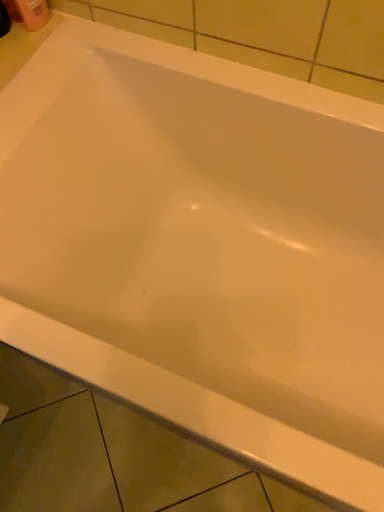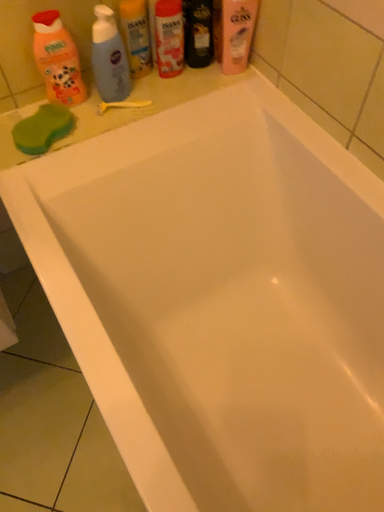
Question: How did the camera likely rotate when shooting the video?

Choices:
 (A) rotated right
 (B) rotated left

Answer: (B)